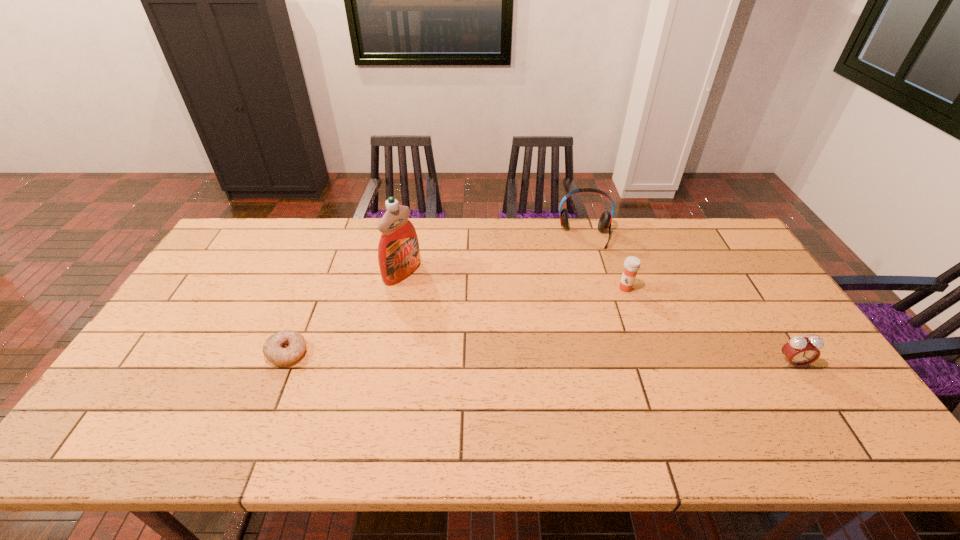
Locate an element on the screen. This screenshot has width=960, height=540. headset at the far edge is located at coordinates (604, 223).

Locate an element on the screen. The width and height of the screenshot is (960, 540). object present at the right edge is located at coordinates (800, 351).

In the image, there is a desktop. Where is `free space at the far edge`? The width and height of the screenshot is (960, 540). free space at the far edge is located at coordinates (314, 222).

Image resolution: width=960 pixels, height=540 pixels. In the image, there is a desktop. Find the location of `vacant space at the near edge`. vacant space at the near edge is located at coordinates (612, 397).

Find the location of a particular element. Image resolution: width=960 pixels, height=540 pixels. vacant space at the left edge is located at coordinates (209, 280).

Image resolution: width=960 pixels, height=540 pixels. I want to click on free space at the right edge of the desktop, so click(791, 379).

This screenshot has width=960, height=540. I want to click on vacant area at the far left corner of the desktop, so click(248, 220).

The height and width of the screenshot is (540, 960). Identify the location of free spot between the shortest object and the alarm clock. (540, 358).

In order to click on vacant space that is in between the rightmost object and the doughnut in this screenshot , I will do `click(540, 358)`.

Identify the location of vacant space that's between the farthest object and the medicine. The height and width of the screenshot is (540, 960). (605, 262).